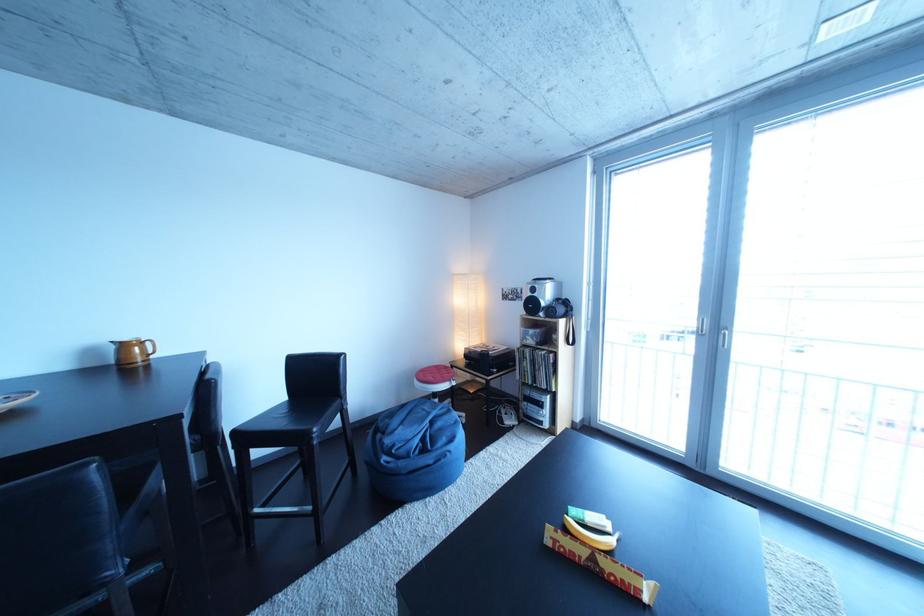
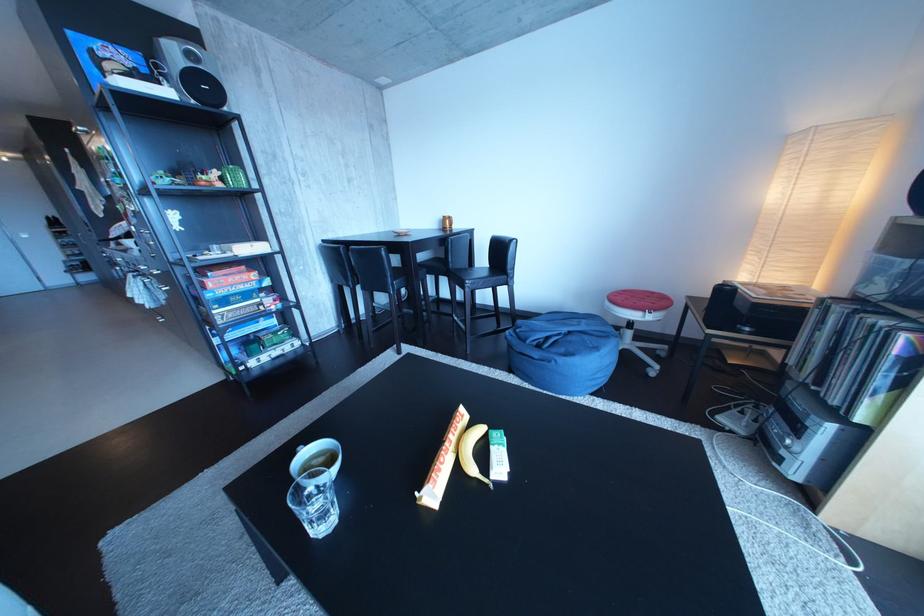
The point at (579, 536) is marked in the first image. Where is the corresponding point in the second image?

(479, 430)